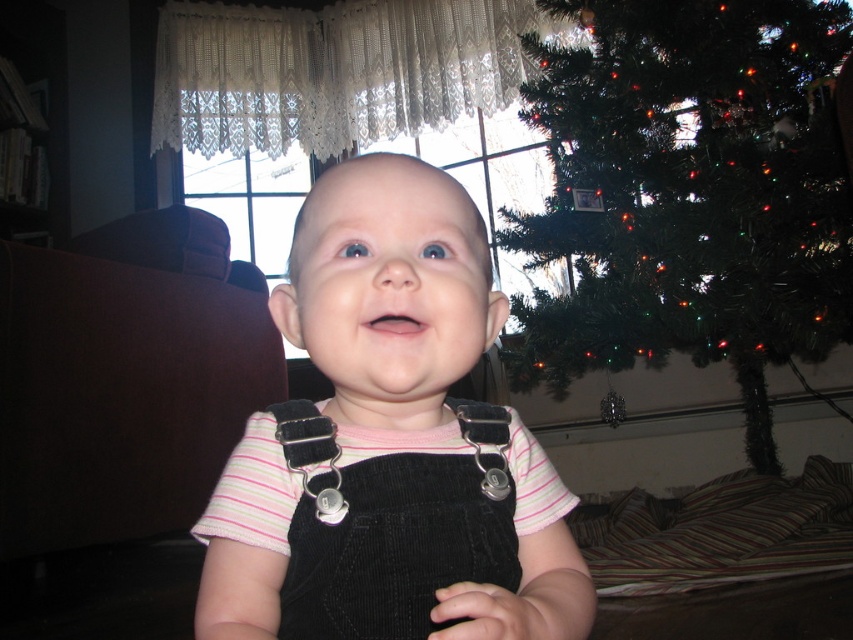
You are a parent trying to decide if the green artificial christmas tree at upper right can be moved closer to the baby without blocking the view of the black corduroy suspenders at center. Based on their widths, can the tree be moved closer without overlapping the suspenders?

The green artificial christmas tree at upper right is wider than the black corduroy suspenders at center. Since the tree is wider, moving it closer might cause it to overlap the suspenders, so it might not be advisable to move it closer without adjusting its position carefully.

Looking at this image, you are a photographer setting up for a family portrait. You need to ensure that the black corduroy overalls at center and the green artificial christmas tree at upper right are both visible in the frame. Given their sizes, which object will require more space horizontally in the photo?

The green artificial christmas tree at upper right will require more space horizontally in the photo because its width is greater than the black corduroy overalls at center.